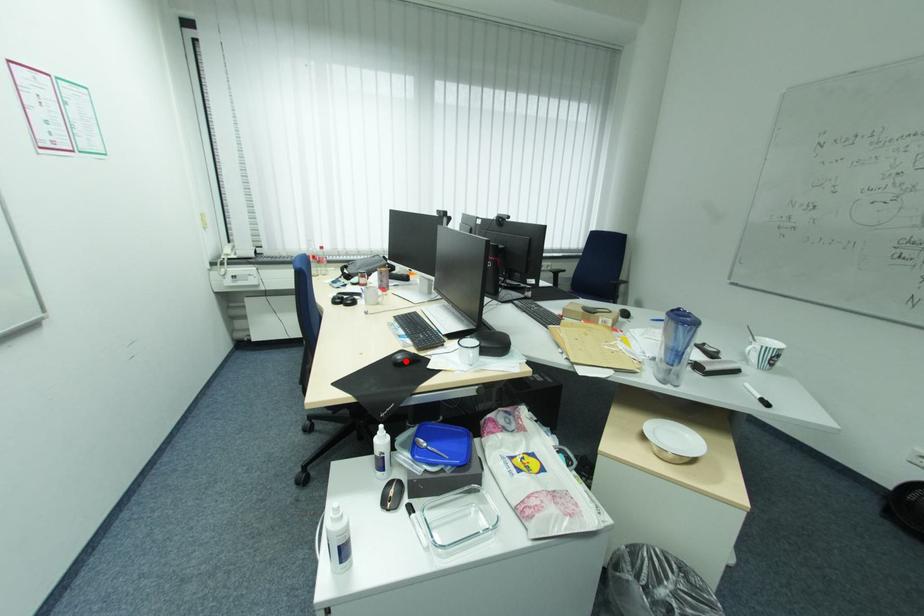
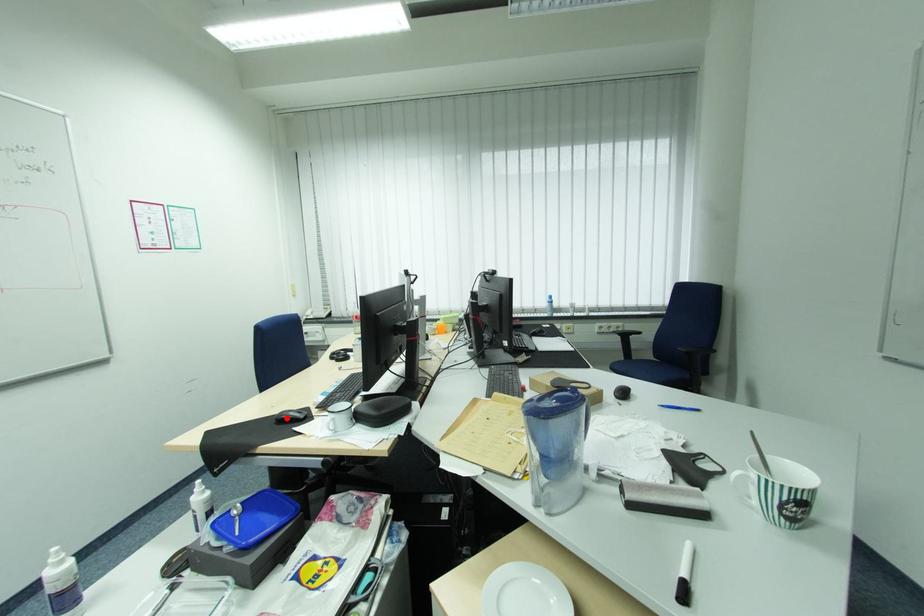
In the scene shown: I am providing you with two images of the same scene from different viewpoints. A red point is marked on the first image and another point is marked on the second image. Is the red point in image1 aligned with the point shown in image2?

Yes